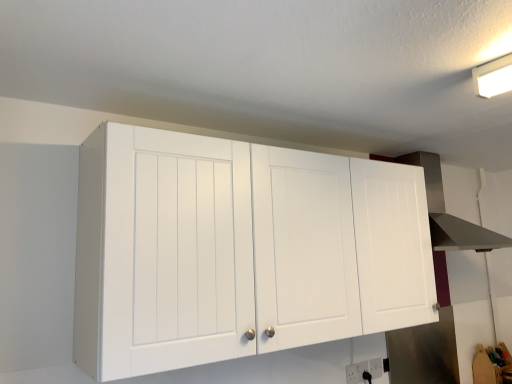
I want to click on stainless steel vent at upper right, so click(x=449, y=214).

Identify the location of white plastic electric outlet at lower center, arranged as the first electric outlet when viewed from the right. (375, 367).

The image size is (512, 384). I want to click on stainless steel vent at upper right, so click(449, 214).

From the image's perspective, which object appears higher, stainless steel vent at upper right or white plastic electric outlet at lower center, which ranks as the 1th electric outlet in left-to-right order?

stainless steel vent at upper right, from the image's perspective.

Which point is more distant from viewer, (451, 232) or (348, 373)?

The point (451, 232) is farther.

From the picture: Can you tell me how much stainless steel vent at upper right and white plastic electric outlet at lower center, which ranks as the 1th electric outlet in left-to-right order, differ in facing direction?

They differ by 1.49 degrees in their facing directions.

Could you tell me if stainless steel vent at upper right is facing white plastic electric outlet at lower center, which ranks as the 1th electric outlet in left-to-right order?

No, stainless steel vent at upper right is not facing towards white plastic electric outlet at lower center, which ranks as the 1th electric outlet in left-to-right order.

Based on their positions, is white plastic electric outlet at lower center, the first electric outlet viewed from the front, located to the left or right of white plastic electric outlet at lower center, arranged as the first electric outlet when viewed from the right?

In the image, white plastic electric outlet at lower center, the first electric outlet viewed from the front, appears on the left side of white plastic electric outlet at lower center, arranged as the first electric outlet when viewed from the right.

From a real-world perspective, is white plastic electric outlet at lower center, the first electric outlet viewed from the front, above or below white plastic electric outlet at lower center, the second electric outlet positioned from the left?

From a real-world perspective, white plastic electric outlet at lower center, the first electric outlet viewed from the front, is physically below white plastic electric outlet at lower center, the second electric outlet positioned from the left.

Is white plastic electric outlet at lower center, the first electric outlet viewed from the front, inside or outside of white plastic electric outlet at lower center, the second electric outlet positioned from the left?

white plastic electric outlet at lower center, the first electric outlet viewed from the front, is not enclosed by white plastic electric outlet at lower center, the second electric outlet positioned from the left.

Is white plastic electric outlet at lower center, positioned as the 2th electric outlet in right-to-left order, located within white matte cabinet at upper center?

No.

From the image's perspective, is white matte cabinet at upper center located beneath white plastic electric outlet at lower center, which ranks as the 1th electric outlet in left-to-right order?

No.

Is white matte cabinet at upper center facing away from white plastic electric outlet at lower center, arranged as the 2th electric outlet when viewed from the back?

No, white matte cabinet at upper center is not facing the opposite direction of white plastic electric outlet at lower center, arranged as the 2th electric outlet when viewed from the back.

Is point (182, 286) less distant than point (364, 379)?

Yes, it is in front of point (364, 379).

Are white matte cabinet at upper center and white plastic electric outlet at lower center, arranged as the first electric outlet when viewed from the right, making contact?

No, white matte cabinet at upper center is not touching white plastic electric outlet at lower center, arranged as the first electric outlet when viewed from the right.

What's the angular difference between white matte cabinet at upper center and white plastic electric outlet at lower center, arranged as the first electric outlet when viewed from the right,'s facing directions?

The facing directions of white matte cabinet at upper center and white plastic electric outlet at lower center, arranged as the first electric outlet when viewed from the right, are 0.00571 degrees apart.

Considering the relative positions of white matte cabinet at upper center and white plastic electric outlet at lower center, placed as the first electric outlet when sorted from back to front, in the image provided, is white matte cabinet at upper center behind white plastic electric outlet at lower center, placed as the first electric outlet when sorted from back to front,?

No, white matte cabinet at upper center is closer to the camera.

Where is `cupboard in front of the white plastic electric outlet at lower center, which appears as the 2th electric outlet when viewed from the front`? cupboard in front of the white plastic electric outlet at lower center, which appears as the 2th electric outlet when viewed from the front is located at coordinates (239, 250).

Considering the points (368, 360) and (429, 185), which point is in front, point (368, 360) or point (429, 185)?

The point (368, 360) is more forward.

Is white plastic electric outlet at lower center, arranged as the first electric outlet when viewed from the right, positioned with its back to stainless steel vent at upper right?

That's not correct — white plastic electric outlet at lower center, arranged as the first electric outlet when viewed from the right, is not looking away from stainless steel vent at upper right.

Considering the sizes of objects white plastic electric outlet at lower center, arranged as the first electric outlet when viewed from the right, and stainless steel vent at upper right in the image provided, who is taller, white plastic electric outlet at lower center, arranged as the first electric outlet when viewed from the right, or stainless steel vent at upper right?

With more height is stainless steel vent at upper right.

From a real-world perspective, which electric outlet is the 1st one underneath the white matte cabinet at upper center? Please provide its 2D coordinates.

[(375, 367)]

Is white plastic electric outlet at lower center, which appears as the 2th electric outlet when viewed from the front, closer to the viewer compared to white matte cabinet at upper center?

No, white plastic electric outlet at lower center, which appears as the 2th electric outlet when viewed from the front, is further to the viewer.

Would you say white matte cabinet at upper center is part of white plastic electric outlet at lower center, arranged as the first electric outlet when viewed from the right,'s contents?

No, white plastic electric outlet at lower center, arranged as the first electric outlet when viewed from the right, does not contain white matte cabinet at upper center.

From a real-world perspective, between stainless steel vent at upper right and white plastic electric outlet at lower center, the second electric outlet positioned from the left, who is vertically higher?

stainless steel vent at upper right, from a real-world perspective.

Considering the sizes of objects stainless steel vent at upper right and white plastic electric outlet at lower center, arranged as the first electric outlet when viewed from the right, in the image provided, who is smaller, stainless steel vent at upper right or white plastic electric outlet at lower center, arranged as the first electric outlet when viewed from the right,?

Smaller between the two is white plastic electric outlet at lower center, arranged as the first electric outlet when viewed from the right.

Is stainless steel vent at upper right positioned beyond the bounds of white plastic electric outlet at lower center, the second electric outlet positioned from the left?

That's correct, stainless steel vent at upper right is outside of white plastic electric outlet at lower center, the second electric outlet positioned from the left.

Is stainless steel vent at upper right taller than white plastic electric outlet at lower center, the second electric outlet positioned from the left?

Correct, stainless steel vent at upper right is much taller as white plastic electric outlet at lower center, the second electric outlet positioned from the left.

Starting from the stainless steel vent at upper right, which electric outlet is the 1st one behind? Please provide its 2D coordinates.

[(357, 373)]

The height and width of the screenshot is (384, 512). In order to click on electric outlet on the left of the white plastic electric outlet at lower center, which appears as the 2th electric outlet when viewed from the front in this screenshot , I will do `click(357, 373)`.

Based on their spatial positions, is white matte cabinet at upper center or stainless steel vent at upper right closer to white plastic electric outlet at lower center, which appears as the 2th electric outlet when viewed from the front?

Among the two, white matte cabinet at upper center is located nearer to white plastic electric outlet at lower center, which appears as the 2th electric outlet when viewed from the front.

Considering their positions, is white matte cabinet at upper center positioned closer to stainless steel vent at upper right than white plastic electric outlet at lower center, arranged as the 2th electric outlet when viewed from the back?

Based on the image, white plastic electric outlet at lower center, arranged as the 2th electric outlet when viewed from the back, appears to be nearer to stainless steel vent at upper right.

From the image, which object appears to be farther from white matte cabinet at upper center, white plastic electric outlet at lower center, the second electric outlet positioned from the left, or white plastic electric outlet at lower center, which ranks as the 1th electric outlet in left-to-right order?

white plastic electric outlet at lower center, the second electric outlet positioned from the left, is further to white matte cabinet at upper center.

Estimate the real-world distances between objects in this image. Which object is closer to white matte cabinet at upper center, white plastic electric outlet at lower center, arranged as the first electric outlet when viewed from the right, or stainless steel vent at upper right?

white plastic electric outlet at lower center, arranged as the first electric outlet when viewed from the right, is positioned closer to the anchor white matte cabinet at upper center.

When comparing their distances from white plastic electric outlet at lower center, arranged as the 2th electric outlet when viewed from the back, does white matte cabinet at upper center or white plastic electric outlet at lower center, which appears as the 2th electric outlet when viewed from the front, seem further?

Based on the image, white matte cabinet at upper center appears to be further to white plastic electric outlet at lower center, arranged as the 2th electric outlet when viewed from the back.

Looking at this image, estimate the real-world distances between objects in this image. Which object is further from white plastic electric outlet at lower center, the second electric outlet positioned from the left, stainless steel vent at upper right or white plastic electric outlet at lower center, arranged as the 2th electric outlet when viewed from the back?

stainless steel vent at upper right is positioned further to the anchor white plastic electric outlet at lower center, the second electric outlet positioned from the left.

When comparing their distances from white plastic electric outlet at lower center, which appears as the 2th electric outlet when viewed from the front, does white plastic electric outlet at lower center, which ranks as the 1th electric outlet in left-to-right order, or stainless steel vent at upper right seem closer?

white plastic electric outlet at lower center, which ranks as the 1th electric outlet in left-to-right order.

Considering their positions, is white matte cabinet at upper center positioned closer to white plastic electric outlet at lower center, positioned as the 2th electric outlet in right-to-left order, than stainless steel vent at upper right?

The object closer to white plastic electric outlet at lower center, positioned as the 2th electric outlet in right-to-left order, is white matte cabinet at upper center.

Identify the location of vent between white matte cabinet at upper center and white plastic electric outlet at lower center, which ranks as the 1th electric outlet in left-to-right order, along the z-axis. (449, 214).

At what (x,y) coordinates should I click in order to perform the action: click on vent positioned between white matte cabinet at upper center and white plastic electric outlet at lower center, the second electric outlet positioned from the left, from near to far. Please return your answer as a coordinate pair (x, y). The image size is (512, 384). Looking at the image, I should click on (449, 214).

Where is `electric outlet between white matte cabinet at upper center and white plastic electric outlet at lower center, which appears as the 2th electric outlet when viewed from the front, along the z-axis`? This screenshot has width=512, height=384. electric outlet between white matte cabinet at upper center and white plastic electric outlet at lower center, which appears as the 2th electric outlet when viewed from the front, along the z-axis is located at coordinates (357, 373).

You are a GUI agent. You are given a task and a screenshot of the screen. Output one action in this format:
    pyautogui.click(x=<x>, y=<y>)
    Task: Click on the electric outlet between stainless steel vent at upper right and white plastic electric outlet at lower center, the second electric outlet positioned from the left, from top to bottom
    This screenshot has height=384, width=512.
    Given the screenshot: What is the action you would take?
    pyautogui.click(x=357, y=373)